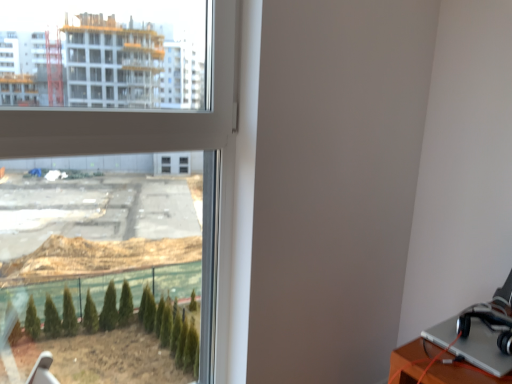
You are a GUI agent. You are given a task and a screenshot of the screen. Output one action in this format:
    pyautogui.click(x=<x>, y=<y>)
    Task: Click on the transparent glass window at upper left
    This screenshot has height=384, width=512.
    Given the screenshot: What is the action you would take?
    pyautogui.click(x=136, y=114)

Measure the distance between point (221,9) and camera.

The distance of point (221,9) from camera is 4.31 feet.

Describe the element at coordinates (136, 114) in the screenshot. I see `transparent glass window at upper left` at that location.

What is the approximate width of transparent glass window at upper left?

transparent glass window at upper left is 1.67 inches in width.

I want to click on transparent glass window at upper left, so click(x=136, y=114).